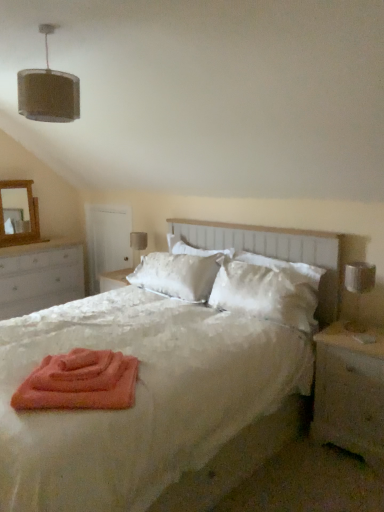
What do you see at coordinates (267, 291) in the screenshot?
I see `satin white pillow at center` at bounding box center [267, 291].

This screenshot has height=512, width=384. What do you see at coordinates (274, 251) in the screenshot?
I see `white satin headboard at center` at bounding box center [274, 251].

The image size is (384, 512). What do you see at coordinates (80, 382) in the screenshot?
I see `soft coral bath towel at center` at bounding box center [80, 382].

From the picture: Measure the distance between point [303,243] and camera.

Point [303,243] is 2.86 meters from camera.

Where is `wooden nightstand at right, which is the 1th nightstand from front to back`? The height and width of the screenshot is (512, 384). wooden nightstand at right, which is the 1th nightstand from front to back is located at coordinates (349, 393).

The height and width of the screenshot is (512, 384). I want to click on satin beige table lamp at center, marked as the 2th table lamp in a right-to-left arrangement, so click(x=138, y=245).

Considering the sizes of wooden nightstand at right, which is the first nightstand from right to left, and soft coral bath towel at center in the image, is wooden nightstand at right, which is the first nightstand from right to left, wider or thinner than soft coral bath towel at center?

Clearly, wooden nightstand at right, which is the first nightstand from right to left, has more width compared to soft coral bath towel at center.

From a real-world perspective, which is physically below, wooden nightstand at right, marked as the 2th nightstand in a left-to-right arrangement, or soft coral bath towel at center?

In real-world perspective, wooden nightstand at right, marked as the 2th nightstand in a left-to-right arrangement, is lower.

Is wooden nightstand at right, marked as the 2th nightstand in a left-to-right arrangement, taller than soft coral bath towel at center?

Yes, wooden nightstand at right, marked as the 2th nightstand in a left-to-right arrangement, is taller than soft coral bath towel at center.

Between wooden nightstand at right, which is the first nightstand from right to left, and soft coral bath towel at center, which one appears on the left side from the viewer's perspective?

soft coral bath towel at center is more to the left.

Looking at this image, can you confirm if white satin headboard at center is positioned to the left of white satin bed at center?

Incorrect, white satin headboard at center is not on the left side of white satin bed at center.

Is white satin headboard at center shorter than white satin bed at center?

Indeed, white satin headboard at center has a lesser height compared to white satin bed at center.

Which object is more forward, white satin headboard at center or white satin bed at center?

white satin bed at center.

From a real-world perspective, who is located higher, white satin headboard at center or white satin bed at center?

white satin headboard at center is physically above.

Is the surface of wooden nightstand at right, which is the first nightstand from right to left, in direct contact with white satin bed at center?

There is a gap between wooden nightstand at right, which is the first nightstand from right to left, and white satin bed at center.

How different are the orientations of wooden nightstand at right, which is the first nightstand from right to left, and white satin bed at center in degrees?

wooden nightstand at right, which is the first nightstand from right to left, and white satin bed at center are facing 1.6 degrees away from each other.

Is wooden nightstand at right, marked as the 2th nightstand in a left-to-right arrangement, taller or shorter than white satin bed at center?

Clearly, wooden nightstand at right, marked as the 2th nightstand in a left-to-right arrangement, is shorter compared to white satin bed at center.

Is point (370, 361) closer to viewer compared to point (14, 338)?

Yes, it is in front of point (14, 338).

Does brown fabric lampshade at upper left appear on the right side of white satin headboard at center?

No.

At what (x,y) coordinates should I click in order to perform the action: click on headboard directly beneath the brown fabric lampshade at upper left (from a real-world perspective). Please return your answer as a coordinate pair (x, y). This screenshot has height=512, width=384. Looking at the image, I should click on [x=274, y=251].

Considering the sizes of objects brown fabric lampshade at upper left and white satin headboard at center in the image provided, who is bigger, brown fabric lampshade at upper left or white satin headboard at center?

With larger size is white satin headboard at center.

Measure the distance between brown fabric lampshade at upper left and white satin headboard at center.

brown fabric lampshade at upper left is 5.36 feet away from white satin headboard at center.

Can you confirm if soft coral bath towel at center is shorter than wooden nightstand at right, the 2th nightstand viewed from the back?

Yes, soft coral bath towel at center is shorter than wooden nightstand at right, the 2th nightstand viewed from the back.

From a real-world perspective, which is physically below, soft coral bath towel at center or wooden nightstand at right, which is the 1th nightstand from front to back?

In real-world perspective, wooden nightstand at right, which is the 1th nightstand from front to back, is lower.

Which is less distant, (48, 400) or (323, 369)?

Result: The point (48, 400) is in front.

In the scene shown: Is satin beige table lamp at center, arranged as the first table lamp when viewed from the left, further to camera compared to silver metallic table lamp at right, placed as the first table lamp when sorted from front to back?

Yes, it is behind silver metallic table lamp at right, placed as the first table lamp when sorted from front to back.

Which object is thinner, satin beige table lamp at center, marked as the 2th table lamp in a right-to-left arrangement, or silver metallic table lamp at right, placed as the first table lamp when sorted from front to back?

satin beige table lamp at center, marked as the 2th table lamp in a right-to-left arrangement, is thinner.

Between satin beige table lamp at center, which appears as the first table lamp when viewed from the back, and silver metallic table lamp at right, which is the 2th table lamp in back-to-front order, which one appears on the left side from the viewer's perspective?

Positioned to the left is satin beige table lamp at center, which appears as the first table lamp when viewed from the back.

From the image's perspective, is satin beige table lamp at center, marked as the 2th table lamp in a right-to-left arrangement, positioned above or below silver metallic table lamp at right, placed as the first table lamp when sorted from front to back?

Clearly, from the image's perspective, satin beige table lamp at center, marked as the 2th table lamp in a right-to-left arrangement, is above silver metallic table lamp at right, placed as the first table lamp when sorted from front to back.

Consider the image. Does white satin bed at center lie behind satin white pillow at center?

No, white satin bed at center is closer to the camera.

Is white satin bed at center not inside satin white pillow at center?

Yes, white satin bed at center is located beyond the bounds of satin white pillow at center.

Looking at this image, from the image's perspective, is white satin bed at center on top of satin white pillow at center?

Incorrect, from the image's perspective, white satin bed at center is lower than satin white pillow at center.

In terms of width, does white satin bed at center look wider or thinner when compared to satin white pillow at center?

Considering their sizes, white satin bed at center looks broader than satin white pillow at center.

At what (x,y) coordinates should I click in order to perform the action: click on bath towel that appears above the wooden nightstand at right, marked as the 2th nightstand in a left-to-right arrangement (from the image's perspective). Please return your answer as a coordinate pair (x, y). This screenshot has height=512, width=384. Looking at the image, I should click on (80, 382).

Where is `headboard above the white satin bed at center (from a real-world perspective)`? This screenshot has width=384, height=512. headboard above the white satin bed at center (from a real-world perspective) is located at coordinates (274, 251).

In the scene shown: Considering their positions, is satin beige table lamp at center, marked as the 2th table lamp in a right-to-left arrangement, positioned further to brown fabric lampshade at upper left than soft coral bath towel at center?

Based on the image, satin beige table lamp at center, marked as the 2th table lamp in a right-to-left arrangement, appears to be further to brown fabric lampshade at upper left.

Based on their spatial positions, is brown fabric lampshade at upper left or white wood dresser at left, the 2th nightstand positioned from the right, closer to white satin bed at center?

The object closer to white satin bed at center is brown fabric lampshade at upper left.

Looking at the image, which one is located closer to brown fabric lampshade at upper left, white satin headboard at center or white satin bed at center?

white satin bed at center lies closer to brown fabric lampshade at upper left than the other object.

Based on their spatial positions, is wooden nightstand at right, marked as the 2th nightstand in a left-to-right arrangement, or brown fabric lampshade at upper left closer to satin beige table lamp at center, which appears as the first table lamp when viewed from the back?

brown fabric lampshade at upper left lies closer to satin beige table lamp at center, which appears as the first table lamp when viewed from the back, than the other object.

From the image, which object appears to be farther from satin beige table lamp at center, which appears as the first table lamp when viewed from the back, wooden nightstand at right, which is the first nightstand from right to left, or white satin bed at center?

The object further to satin beige table lamp at center, which appears as the first table lamp when viewed from the back, is wooden nightstand at right, which is the first nightstand from right to left.

Looking at the image, which one is located further to wooden mirror at upper left, silver metallic table lamp at right, the first table lamp when ordered from right to left, or satin white pillow at center?

silver metallic table lamp at right, the first table lamp when ordered from right to left.

From the picture: From the image, which object appears to be nearer to soft coral bath towel at center, satin beige table lamp at center, which appears as the first table lamp when viewed from the back, or white satin bed at center?

Based on the image, white satin bed at center appears to be nearer to soft coral bath towel at center.

Estimate the real-world distances between objects in this image. Which object is closer to satin beige table lamp at center, which appears as the first table lamp when viewed from the back, brown fabric lampshade at upper left or silver metallic table lamp at right, which is the 2th table lamp in back-to-front order?

brown fabric lampshade at upper left.

Find the location of a particular element. This screenshot has width=384, height=512. table lamp between white satin bed at center and white wood dresser at left, the first nightstand when ordered from left to right, along the z-axis is located at coordinates (358, 289).

Where is `bed between soft coral bath towel at center and silver metallic table lamp at right, placed as the first table lamp when sorted from front to back`? This screenshot has height=512, width=384. bed between soft coral bath towel at center and silver metallic table lamp at right, placed as the first table lamp when sorted from front to back is located at coordinates (140, 398).

I want to click on headboard located between white satin bed at center and wooden mirror at upper left in the depth direction, so (274, 251).

The width and height of the screenshot is (384, 512). What are the coordinates of `pillow between wooden mirror at upper left and wooden nightstand at right, the 2th nightstand viewed from the back, in the horizontal direction` in the screenshot? It's located at (267, 291).